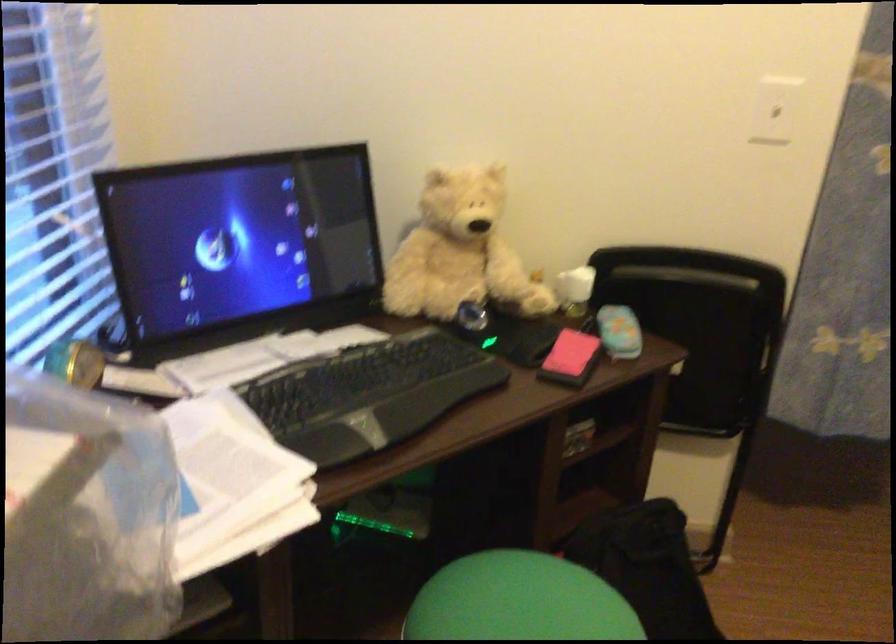
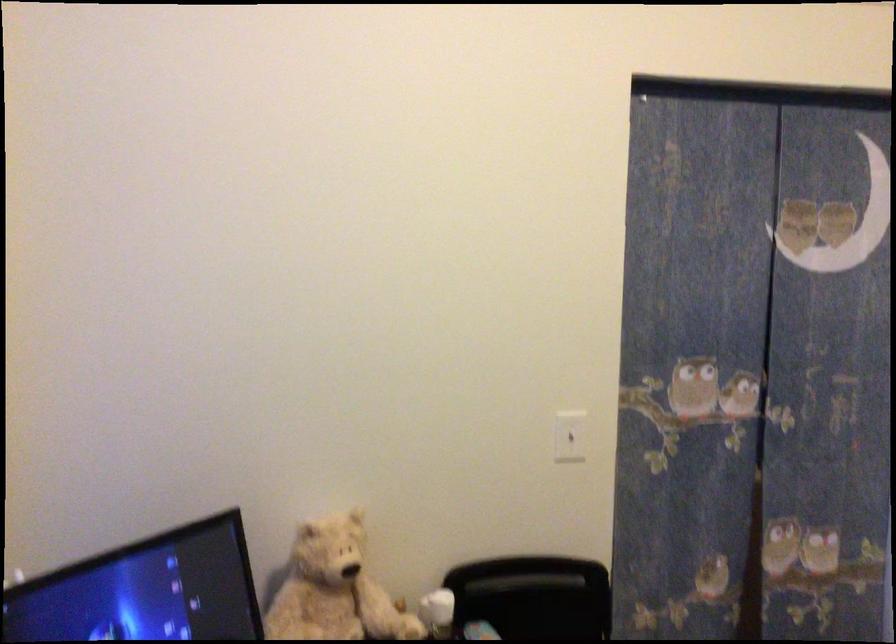
The point at [471,236] is marked in the first image. Where is the corresponding point in the second image?

(334, 589)